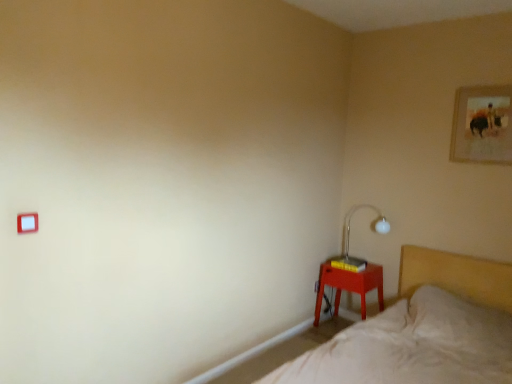
This screenshot has width=512, height=384. I want to click on vacant space underneath white glass table lamp at right (from a real-world perspective), so click(x=361, y=262).